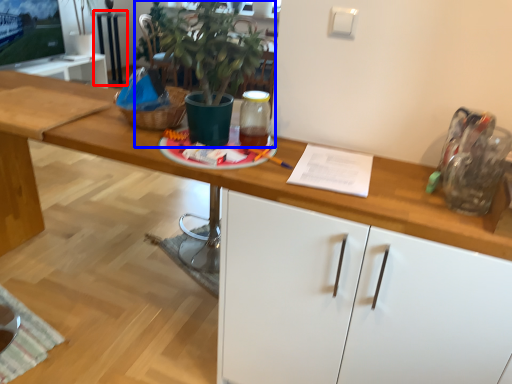
Question: Which point is closer to the camera, table (highlighted by a red box) or houseplant (highlighted by a blue box)?

Choices:
 (A) table
 (B) houseplant

Answer: (B)